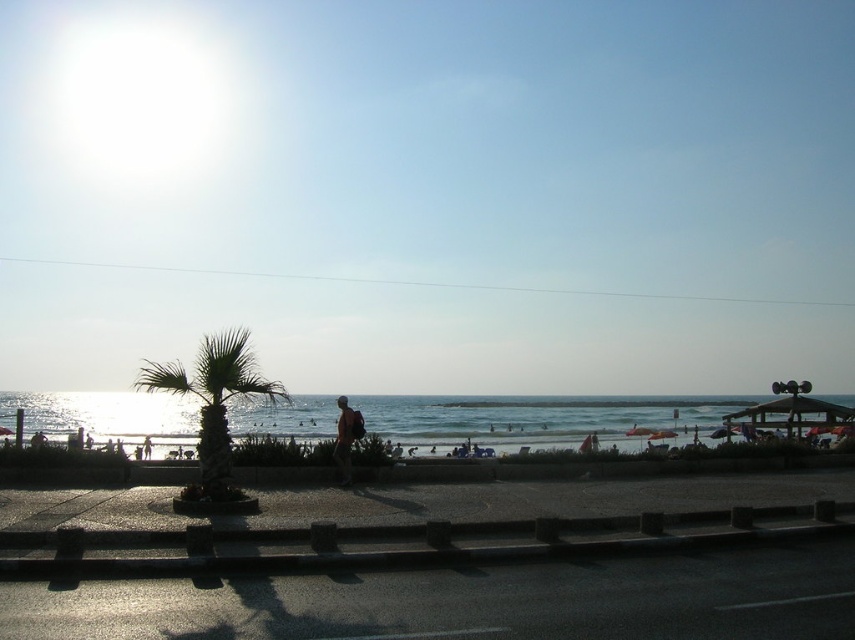
Question: Can you confirm if bright blue sky at upper center is positioned to the right of green leafy palm tree at center?

Choices:
 (A) no
 (B) yes

Answer: (B)

Question: Considering the real-world distances, which object is farthest from the bright blue sky at upper center?

Choices:
 (A) shiny blue water at center
 (B) green leafy palm tree at center

Answer: (B)

Question: Among these objects, which one is farthest from the camera?

Choices:
 (A) shiny blue water at center
 (B) bright blue sky at upper center
 (C) tan fabric shirt at center
 (D) green leafy palm tree at center

Answer: (C)

Question: Can you confirm if bright blue sky at upper center is thinner than tan fabric shirt at center?

Choices:
 (A) no
 (B) yes

Answer: (A)

Question: Can you confirm if bright blue sky at upper center is wider than shiny blue water at center?

Choices:
 (A) no
 (B) yes

Answer: (B)

Question: Among these objects, which one is farthest from the camera?

Choices:
 (A) bright blue sky at upper center
 (B) shiny blue water at center

Answer: (B)